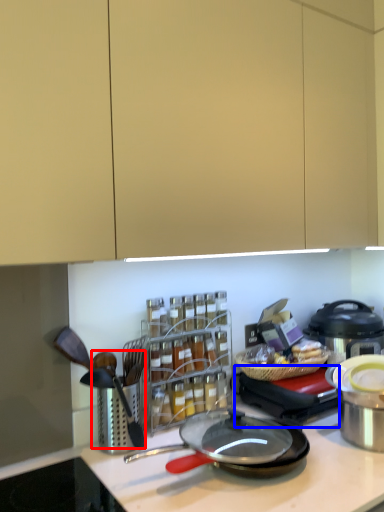
Question: Which object appears closest to the camera in this image, utensil (highlighted by a red box) or appliance (highlighted by a blue box)?

Choices:
 (A) utensil
 (B) appliance

Answer: (A)